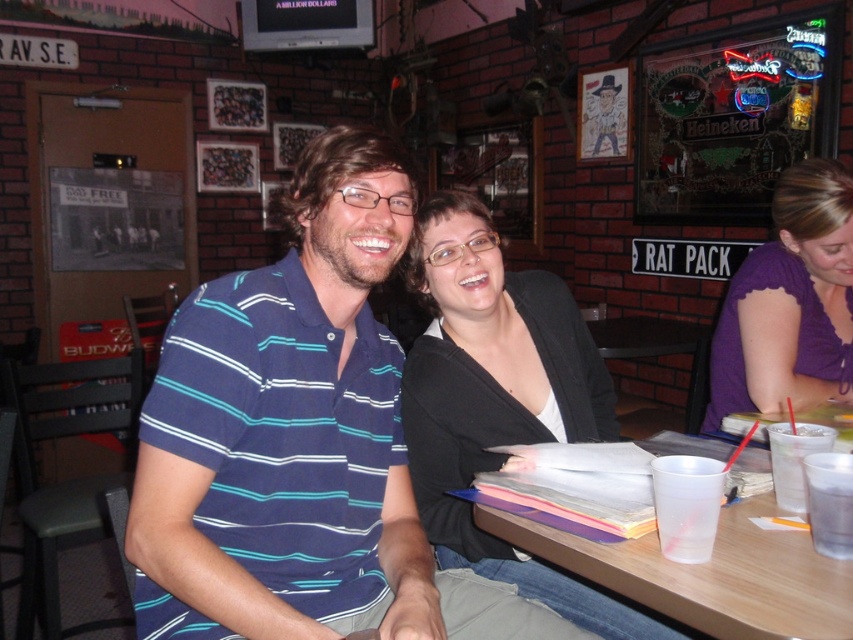
Which is more to the right, blue striped polo shirt at center or translucent plastic cup at table right?

translucent plastic cup at table right

Can you confirm if blue striped polo shirt at center is positioned below translucent plastic cup at table right?

No.

Which is behind, point (374, 193) or point (787, 470)?

The point (374, 193) is more distant.

Where is `blue striped polo shirt at center`? This screenshot has height=640, width=853. blue striped polo shirt at center is located at coordinates (299, 442).

Is blue striped polo shirt at center above purple satin blouse at upper right?

No.

Can you confirm if blue striped polo shirt at center is positioned to the left of purple satin blouse at upper right?

Correct, you'll find blue striped polo shirt at center to the left of purple satin blouse at upper right.

Does point (352, 368) lie in front of point (757, 288)?

Yes, point (352, 368) is closer to viewer.

Where is `blue striped polo shirt at center`? blue striped polo shirt at center is located at coordinates (299, 442).

Is blue striped polo shirt at left wider than black matte cardigan at center?

No, blue striped polo shirt at left is not wider than black matte cardigan at center.

Is point (146, 620) closer to viewer compared to point (602, 426)?

Yes, point (146, 620) is in front of point (602, 426).

I want to click on blue striped polo shirt at left, so coord(283,433).

This screenshot has height=640, width=853. I want to click on blue striped polo shirt at left, so click(283, 433).